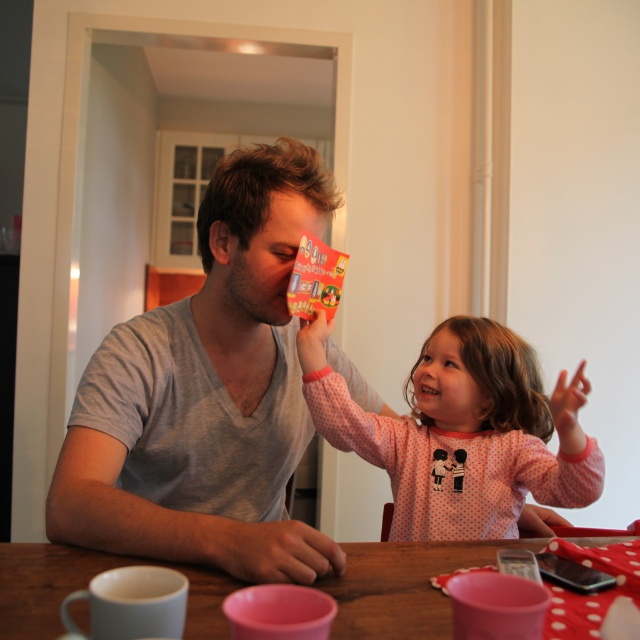
Question: Is gray cotton shirt at center smaller than pink dotted pajamas at center?

Choices:
 (A) no
 (B) yes

Answer: (A)

Question: Which point is closer to the camera taking this photo?

Choices:
 (A) (36, 557)
 (B) (198, 419)

Answer: (A)

Question: Which object is closer to the camera taking this photo?

Choices:
 (A) pink dotted pajamas at center
 (B) wooden table at center

Answer: (B)

Question: Is pink dotted pajamas at center closer to the viewer compared to wooden table at center?

Choices:
 (A) no
 (B) yes

Answer: (A)

Question: Which object appears farthest from the camera in this image?

Choices:
 (A) wooden table at center
 (B) gray cotton shirt at center

Answer: (B)

Question: Does gray cotton shirt at center appear on the left side of pink dotted pajamas at center?

Choices:
 (A) yes
 (B) no

Answer: (A)